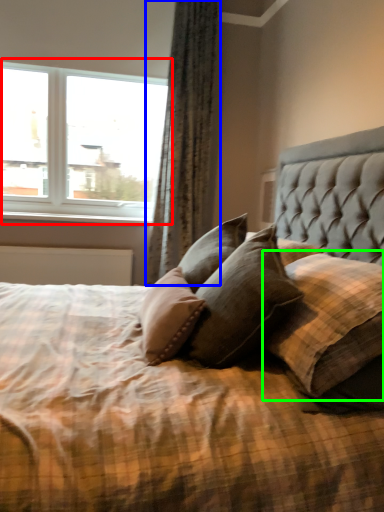
Question: Based on their relative distances, which object is farther from window (highlighted by a red box)? Choose from curtain (highlighted by a blue box) and pillow (highlighted by a green box).

Choices:
 (A) curtain
 (B) pillow

Answer: (B)